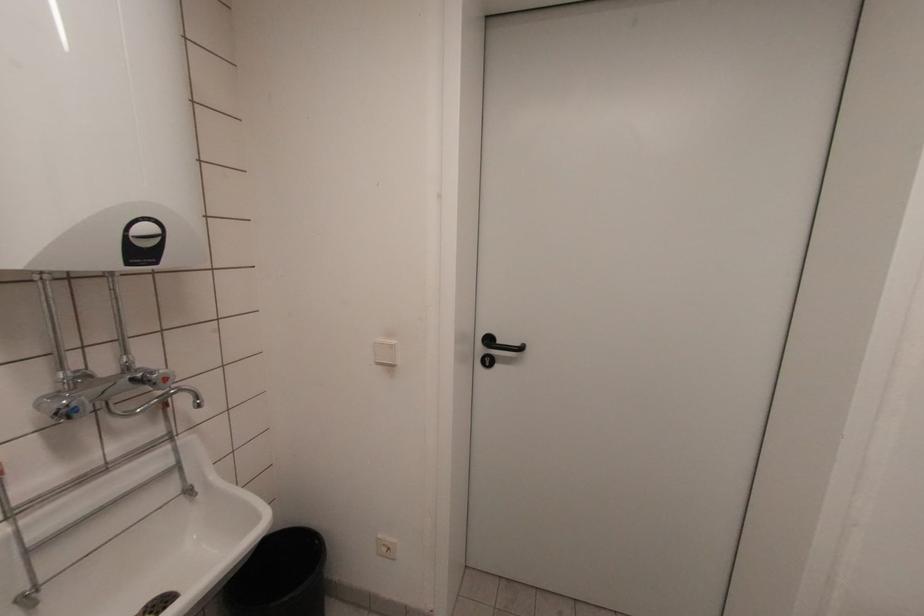
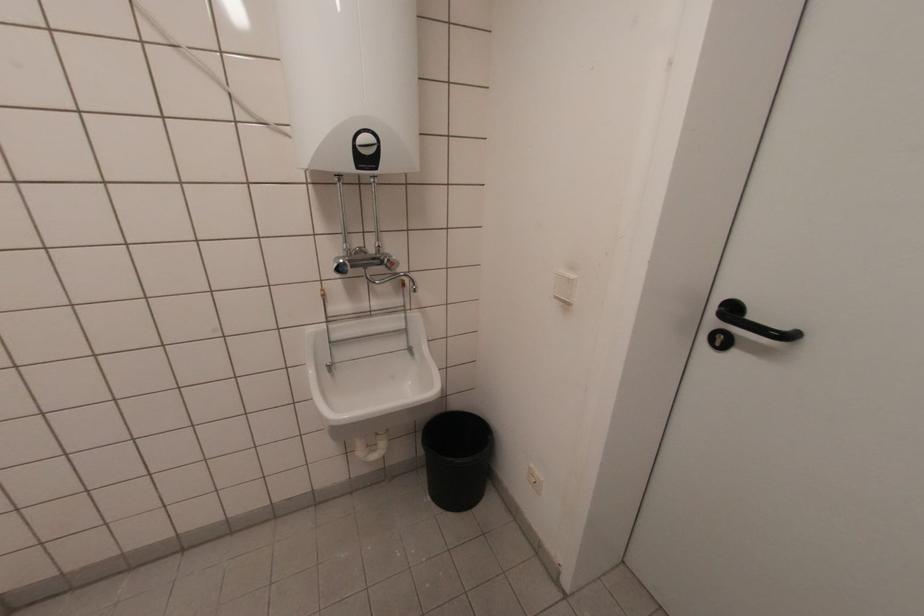
The point at (x=160, y=238) is marked in the first image. Where is the corresponding point in the second image?

(377, 148)